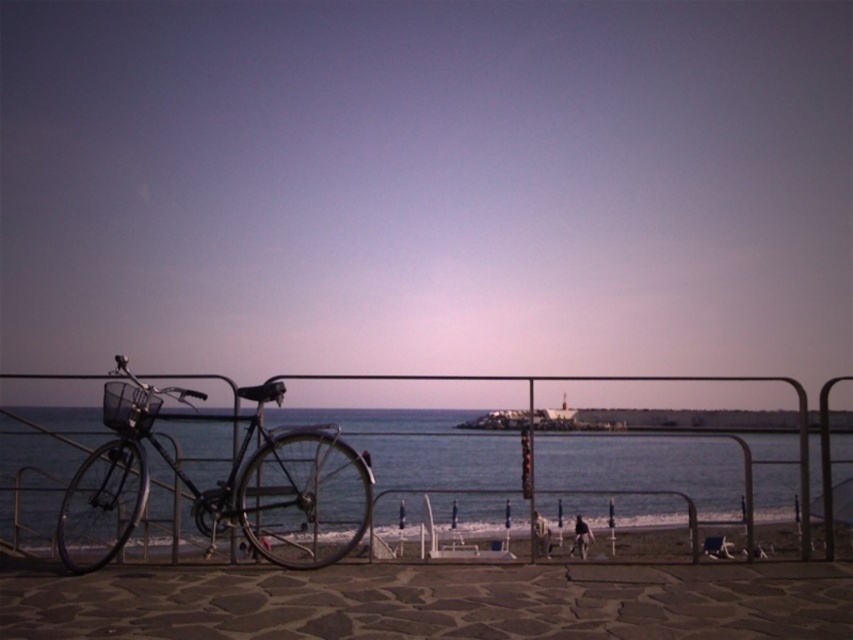
You are a photographer wanting to capture the entire scene in one shot. Given that your camera can only focus on objects within a 10m x 10m area, and knowing the size relationship between the blue water at center and the shiny black bicycle at left, which object should you prioritize framing closer to ensure both are visible?

The blue water at center is bigger than the shiny black bicycle at left, so you should prioritize framing the blue water at center closer to ensure both are visible within the camera frame.

You are standing on the walkway and want to take a photo of the blue water at center without the shiny black bicycle at left appearing in the frame. Which direction should you move to ensure the bicycle is out of the shot?

Since the shiny black bicycle at left is behind the blue water at center, you can move to the right side of the walkway to position yourself where the bicycle is no longer blocking the view of the blue water at center.

You are a photographer standing on the walkway. You want to take a photo that includes both the blue water at center and the shiny black bicycle at left. Given that your camera has a maximum focus range of 1 meter, will you be able to capture both subjects in focus?

The blue water at center and the shiny black bicycle at left are 88.43 centimeters apart from each other. Since 88.43 cm is less than 1 meter, the camera can focus on both subjects within its maximum focus range of 1 meter.